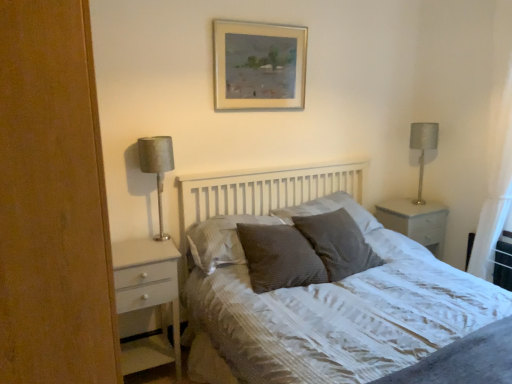
Question: From the image's perspective, does white textured bed at center appear higher than textured gray pillow at center, acting as the second pillow starting from the right?

Choices:
 (A) no
 (B) yes

Answer: (A)

Question: Considering the relative sizes of white textured bed at center and textured gray pillow at center, positioned as the 3th pillow in left-to-right order, in the image provided, is white textured bed at center smaller than textured gray pillow at center, positioned as the 3th pillow in left-to-right order,?

Choices:
 (A) yes
 (B) no

Answer: (B)

Question: Can you confirm if white textured bed at center is taller than textured gray pillow at center, acting as the second pillow starting from the right?

Choices:
 (A) no
 (B) yes

Answer: (B)

Question: Can you see white textured bed at center touching textured gray pillow at center, positioned as the 3th pillow in left-to-right order?

Choices:
 (A) yes
 (B) no

Answer: (B)

Question: Does white textured bed at center have a greater width compared to textured gray pillow at center, acting as the second pillow starting from the right?

Choices:
 (A) no
 (B) yes

Answer: (B)

Question: Is there a large distance between white textured bed at center and textured gray pillow at center, positioned as the 3th pillow in left-to-right order?

Choices:
 (A) no
 (B) yes

Answer: (A)

Question: Does white textured bed at center turn towards gold-framed painting at upper center?

Choices:
 (A) yes
 (B) no

Answer: (B)

Question: Considering the relative sizes of white textured bed at center and gold-framed painting at upper center in the image provided, is white textured bed at center smaller than gold-framed painting at upper center?

Choices:
 (A) yes
 (B) no

Answer: (B)

Question: From the image's perspective, does white textured bed at center appear higher than gold-framed painting at upper center?

Choices:
 (A) no
 (B) yes

Answer: (A)

Question: Can you confirm if white textured bed at center is shorter than gold-framed painting at upper center?

Choices:
 (A) yes
 (B) no

Answer: (B)

Question: Can you confirm if white textured bed at center is taller than gold-framed painting at upper center?

Choices:
 (A) yes
 (B) no

Answer: (A)

Question: From the image's perspective, is white textured bed at center below gold-framed painting at upper center?

Choices:
 (A) no
 (B) yes

Answer: (B)

Question: From a real-world perspective, does dark grey textured pillow at center, positioned as the 3th pillow in right-to-left order, sit lower than textured gray pillow at center, acting as the second pillow starting from the right?

Choices:
 (A) yes
 (B) no

Answer: (A)